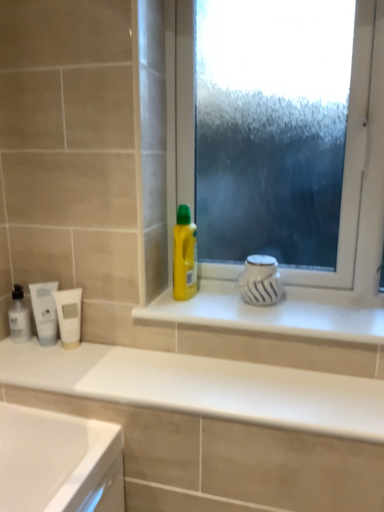
What do you see at coordinates (69, 316) in the screenshot? I see `white matte tube at lower left, which is the third mouthwash in left-to-right order` at bounding box center [69, 316].

Locate an element on the screen. The image size is (384, 512). frosted glass window at center is located at coordinates (180, 110).

What is the approximate height of white matte tube at left, which is the 2th mouthwash from right to left?

Answer: white matte tube at left, which is the 2th mouthwash from right to left, is 7.66 inches tall.

In order to click on white matte tube at left, the second mouthwash viewed from the left in this screenshot , I will do `click(45, 311)`.

What do you see at coordinates (276, 312) in the screenshot?
I see `white glossy window sill at center` at bounding box center [276, 312].

The image size is (384, 512). Describe the element at coordinates (19, 316) in the screenshot. I see `translucent plastic mouthwash at left, which is the third mouthwash in right-to-left order` at that location.

Identify the location of white matte tube at lower left, the 1th mouthwash from the right. (69, 316).

Can you see white glossy window sill at center touching white matte tube at left, which is the 2th mouthwash from right to left?

No, white glossy window sill at center is not making contact with white matte tube at left, which is the 2th mouthwash from right to left.

How distant is white glossy window sill at center from white matte tube at left, the second mouthwash viewed from the left?

white glossy window sill at center is 20.39 inches from white matte tube at left, the second mouthwash viewed from the left.

Does white glossy window sill at center lie in front of white matte tube at left, which is the 2th mouthwash from right to left?

Yes, white glossy window sill at center is in front of white matte tube at left, which is the 2th mouthwash from right to left.

Looking at this image, can you confirm if white glossy window sill at center is smaller than white matte tube at left, the second mouthwash viewed from the left?

Actually, white glossy window sill at center might be larger than white matte tube at left, the second mouthwash viewed from the left.

Is white glossy window sill at center located outside translucent plastic mouthwash at left, which is the third mouthwash in right-to-left order?

Yes, white glossy window sill at center is outside of translucent plastic mouthwash at left, which is the third mouthwash in right-to-left order.

Considering the sizes of white glossy window sill at center and translucent plastic mouthwash at left, which is the third mouthwash in right-to-left order, in the image, is white glossy window sill at center wider or thinner than translucent plastic mouthwash at left, which is the third mouthwash in right-to-left order,?

Considering their sizes, white glossy window sill at center looks broader than translucent plastic mouthwash at left, which is the third mouthwash in right-to-left order.

The width and height of the screenshot is (384, 512). Identify the location of mouthwash that is the 3rd one when counting leftward from the white glossy window sill at center. (19, 316).

How many degrees apart are the facing directions of white matte tube at lower left, which is the third mouthwash in left-to-right order, and white glossy jar at center?

There is a 36.6-degree angle between the facing directions of white matte tube at lower left, which is the third mouthwash in left-to-right order, and white glossy jar at center.

From a real-world perspective, is white matte tube at lower left, the 1th mouthwash from the right, on white glossy jar at center?

Actually, white matte tube at lower left, the 1th mouthwash from the right, is physically below white glossy jar at center in the real world.

Is white glossy jar at center at the back of white matte tube at lower left, the 1th mouthwash from the right?

white matte tube at lower left, the 1th mouthwash from the right, is not turned away from white glossy jar at center.

Who is smaller, white matte tube at lower left, the 1th mouthwash from the right, or white glossy jar at center?

white matte tube at lower left, the 1th mouthwash from the right.

Which is in front, white glossy counter top at lower center or white glossy jar at center?

white glossy counter top at lower center is closer to the camera.

Between white glossy counter top at lower center and white glossy jar at center, which one has larger size?

With larger size is white glossy counter top at lower center.

This screenshot has height=512, width=384. I want to click on appliance positioned vertically above the white glossy counter top at lower center (from a real-world perspective), so click(260, 281).

Considering the points (270, 399) and (250, 283), which point is in front, point (270, 399) or point (250, 283)?

The point (270, 399) is more forward.

Is yellow plastic bottle at center wider or thinner than white glossy counter top at lower center?

Clearly, yellow plastic bottle at center has less width compared to white glossy counter top at lower center.

Is yellow plastic bottle at center not inside white glossy counter top at lower center?

Yes, yellow plastic bottle at center is located beyond the bounds of white glossy counter top at lower center.

Is yellow plastic bottle at center to the left of white glossy counter top at lower center from the viewer's perspective?

In fact, yellow plastic bottle at center is to the right of white glossy counter top at lower center.

From a real-world perspective, who is located higher, yellow plastic bottle at center or white glossy counter top at lower center?

In real-world perspective, yellow plastic bottle at center is above.

Is yellow plastic bottle at center facing towards white matte tube at lower left, which is the third mouthwash in left-to-right order?

No, yellow plastic bottle at center is not oriented towards white matte tube at lower left, which is the third mouthwash in left-to-right order.

From a real-world perspective, is yellow plastic bottle at center on white matte tube at lower left, which is the third mouthwash in left-to-right order?

Yes, from a real-world perspective, yellow plastic bottle at center is on top of white matte tube at lower left, which is the third mouthwash in left-to-right order.

From the picture: Does yellow plastic bottle at center have a greater width compared to white matte tube at lower left, which is the third mouthwash in left-to-right order?

Correct, the width of yellow plastic bottle at center exceeds that of white matte tube at lower left, which is the third mouthwash in left-to-right order.

Which is nearer, (53, 287) or (230, 305)?

Clearly, point (53, 287) is closer to the camera than point (230, 305).

Is white matte tube at left, which is the 2th mouthwash from right to left, taller than white glossy window sill at center?

Correct, white matte tube at left, which is the 2th mouthwash from right to left, is much taller as white glossy window sill at center.

Based on the photo, considering the relative sizes of white matte tube at left, the second mouthwash viewed from the left, and white glossy window sill at center in the image provided, is white matte tube at left, the second mouthwash viewed from the left, bigger than white glossy window sill at center?

No, white matte tube at left, the second mouthwash viewed from the left, is not bigger than white glossy window sill at center.

Image resolution: width=384 pixels, height=512 pixels. Find the location of `window sill above the white matte tube at left, the second mouthwash viewed from the left (from a real-world perspective)`. window sill above the white matte tube at left, the second mouthwash viewed from the left (from a real-world perspective) is located at coordinates (276, 312).

This screenshot has width=384, height=512. I want to click on window sill above the white matte tube at left, the second mouthwash viewed from the left (from the image's perspective), so coord(276,312).

Locate an element on the screen. window sill that is in front of the translucent plastic mouthwash at left, which is the third mouthwash in right-to-left order is located at coordinates (276, 312).

Which object lies further to the anchor point white matte tube at left, the second mouthwash viewed from the left, white glossy window sill at center or translucent plastic mouthwash at left, which is the third mouthwash in right-to-left order?

white glossy window sill at center.

Which object lies further to the anchor point translucent plastic mouthwash at left, which is counted as the first mouthwash, starting from the left, white glossy jar at center or yellow plastic bottle at center?

Among the two, white glossy jar at center is located further to translucent plastic mouthwash at left, which is counted as the first mouthwash, starting from the left.

Estimate the real-world distances between objects in this image. Which object is closer to white glossy counter top at lower center, white matte tube at lower left, the 1th mouthwash from the right, or translucent plastic mouthwash at left, which is counted as the first mouthwash, starting from the left?

Among the two, white matte tube at lower left, the 1th mouthwash from the right, is located nearer to white glossy counter top at lower center.

Estimate the real-world distances between objects in this image. Which object is further from white matte tube at lower left, the 1th mouthwash from the right, white glossy jar at center or white matte tube at left, which is the 2th mouthwash from right to left?

white glossy jar at center is further to white matte tube at lower left, the 1th mouthwash from the right.

Looking at the image, which one is located closer to white matte tube at left, which is the 2th mouthwash from right to left, translucent plastic mouthwash at left, which is the third mouthwash in right-to-left order, or white glossy counter top at lower center?

Among the two, translucent plastic mouthwash at left, which is the third mouthwash in right-to-left order, is located nearer to white matte tube at left, which is the 2th mouthwash from right to left.

Based on their spatial positions, is yellow plastic bottle at center or white glossy window sill at center closer to white glossy jar at center?

white glossy window sill at center is closer to white glossy jar at center.

Looking at this image, looking at the image, which one is located further to white glossy jar at center, white matte tube at lower left, the 1th mouthwash from the right, or white glossy window sill at center?

The object further to white glossy jar at center is white matte tube at lower left, the 1th mouthwash from the right.

Looking at the image, which one is located further to yellow plastic bottle at center, translucent plastic mouthwash at left, which is counted as the first mouthwash, starting from the left, or white glossy window sill at center?

translucent plastic mouthwash at left, which is counted as the first mouthwash, starting from the left, lies further to yellow plastic bottle at center than the other object.

This screenshot has height=512, width=384. Identify the location of window sill situated between translucent plastic mouthwash at left, which is the third mouthwash in right-to-left order, and white glossy jar at center from left to right. (276, 312).

Locate an element on the screen. Image resolution: width=384 pixels, height=512 pixels. window sill between translucent plastic mouthwash at left, which is counted as the first mouthwash, starting from the left, and frosted glass window at center, in the horizontal direction is located at coordinates (276, 312).

Locate an element on the screen. Image resolution: width=384 pixels, height=512 pixels. counter top situated between translucent plastic mouthwash at left, which is counted as the first mouthwash, starting from the left, and white glossy window sill at center from left to right is located at coordinates (233, 390).

This screenshot has width=384, height=512. What are the coordinates of `mouthwash between white matte tube at left, the second mouthwash viewed from the left, and yellow plastic bottle at center` in the screenshot? It's located at (69, 316).